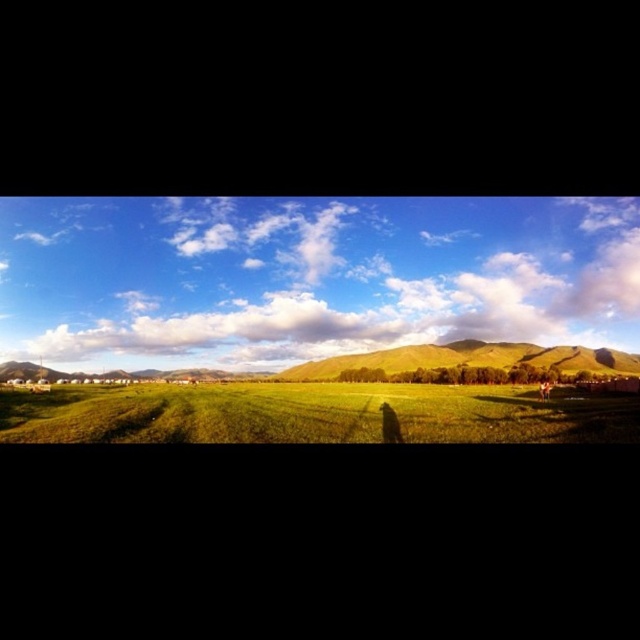
Question: Which of these objects is positioned closest to the green grassy field at center?

Choices:
 (A) green grassy hill at center
 (B) white fluffy cloud at upper center

Answer: (A)

Question: Does white fluffy cloud at upper center appear under green grassy hill at center?

Choices:
 (A) no
 (B) yes

Answer: (A)

Question: Can you confirm if green grassy field at center is smaller than green grassy hill at center?

Choices:
 (A) yes
 (B) no

Answer: (A)

Question: Which of these objects is positioned closest to the green grassy hill at center?

Choices:
 (A) white fluffy cloud at upper center
 (B) brown textured hair at lower right
 (C) green grassy field at center

Answer: (A)

Question: Which of these objects is positioned closest to the green grassy hill at center?

Choices:
 (A) brown textured hair at lower right
 (B) green grassy field at center
 (C) white fluffy cloud at upper center

Answer: (C)

Question: In this image, where is green grassy field at center located relative to green grassy hill at center?

Choices:
 (A) below
 (B) above

Answer: (B)